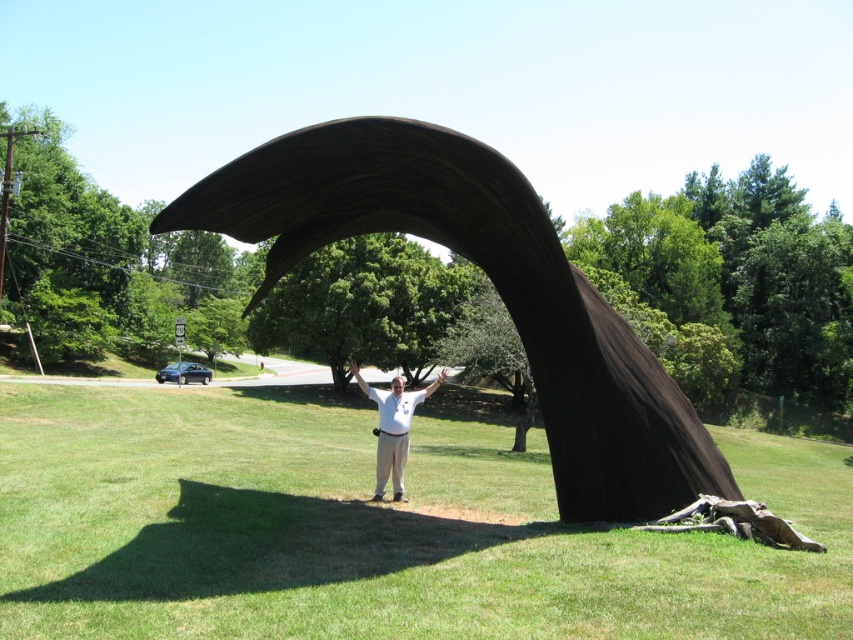
Question: Which point appears closest to the camera in this image?

Choices:
 (A) (328, 189)
 (B) (410, 250)

Answer: (A)

Question: Among these objects, which one is nearest to the camera?

Choices:
 (A) white matte shirt at center
 (B) green leafy tree at center

Answer: (B)

Question: Can you confirm if green grass at center is thinner than green leafy tree at center?

Choices:
 (A) no
 (B) yes

Answer: (A)

Question: Is green grass at center to the left of white matte shirt at center from the viewer's perspective?

Choices:
 (A) no
 (B) yes

Answer: (B)

Question: From the image, what is the correct spatial relationship of green leafy tree at center in relation to white matte shirt at center?

Choices:
 (A) above
 (B) below

Answer: (A)

Question: Which object is closer to the camera taking this photo?

Choices:
 (A) black polished wood arch at center
 (B) white matte shirt at center
 (C) green leafy tree at center

Answer: (A)